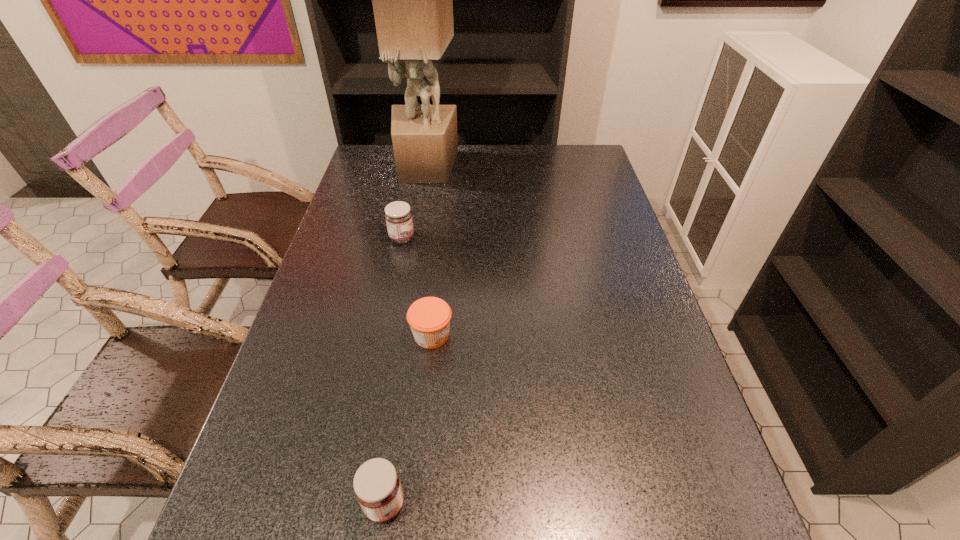
In order to click on sculpture in this screenshot , I will do `click(412, 0)`.

The image size is (960, 540). Find the location of `the tallest object`. the tallest object is located at coordinates (412, 0).

The image size is (960, 540). Find the location of `the second farthest object`. the second farthest object is located at coordinates (398, 216).

At what (x,y) coordinates should I click in order to perform the action: click on the nearest jam. Please return your answer as a coordinate pair (x, y). Image resolution: width=960 pixels, height=540 pixels. Looking at the image, I should click on (377, 487).

Find the location of `the third farthest object`. the third farthest object is located at coordinates (429, 318).

The image size is (960, 540). In order to click on the shortest object in this screenshot , I will do `click(429, 318)`.

The height and width of the screenshot is (540, 960). I want to click on free spot located on the front-facing side of the tallest object, so click(414, 235).

Identify the location of free space located 0.170m on the front label of the third nearest object. The height and width of the screenshot is (540, 960). (471, 238).

The height and width of the screenshot is (540, 960). What are the coordinates of `free space located 0.300m on the back of the nearest object` in the screenshot? It's located at (407, 350).

Find the location of `vacant space situated on the front label of the second nearest jam`. vacant space situated on the front label of the second nearest jam is located at coordinates (527, 335).